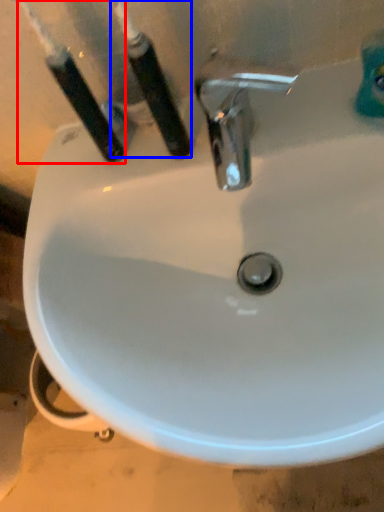
Question: Among these objects, which one is farthest to the camera, toothbrush (highlighted by a red box) or toothbrush (highlighted by a blue box)?

Choices:
 (A) toothbrush
 (B) toothbrush

Answer: (A)